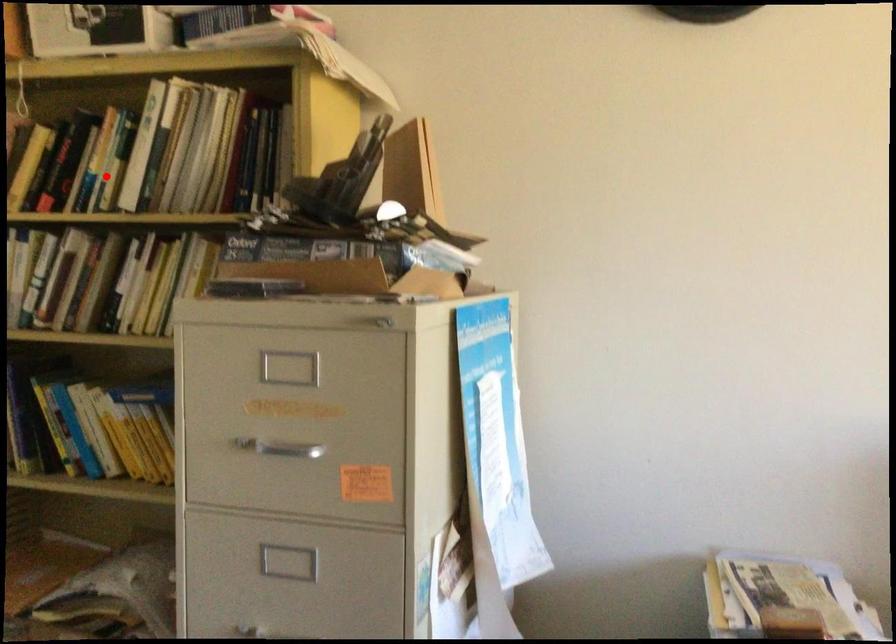
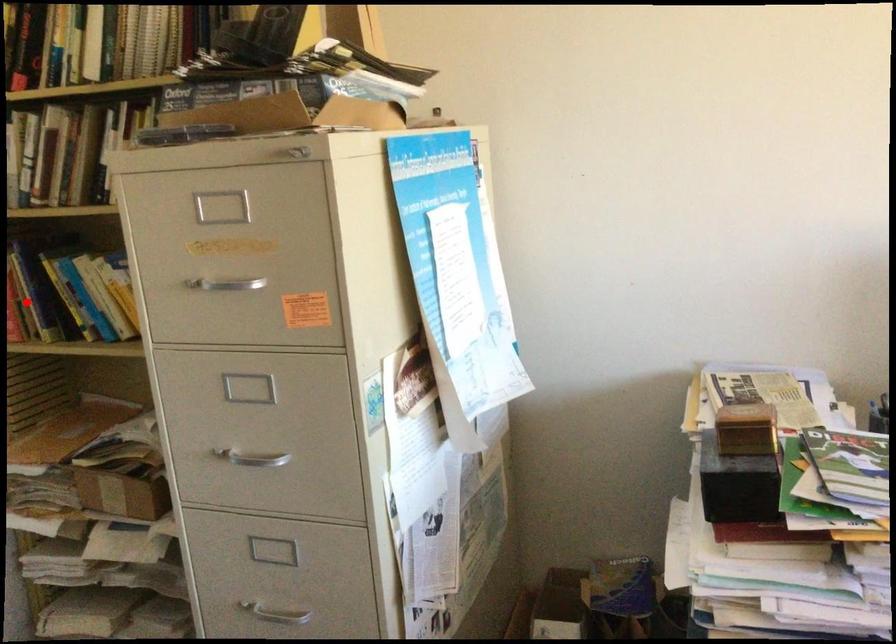
I am providing you with two images of the same scene from different viewpoints. A red point is marked on the first image and another point is marked on the second image. Is the red point in image1 aligned with the point shown in image2?

No